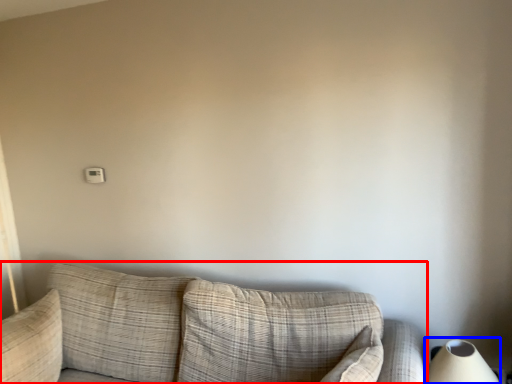
Question: Among these objects, which one is farthest to the camera, studio couch (highlighted by a red box) or table lamp (highlighted by a blue box)?

Choices:
 (A) studio couch
 (B) table lamp

Answer: (B)